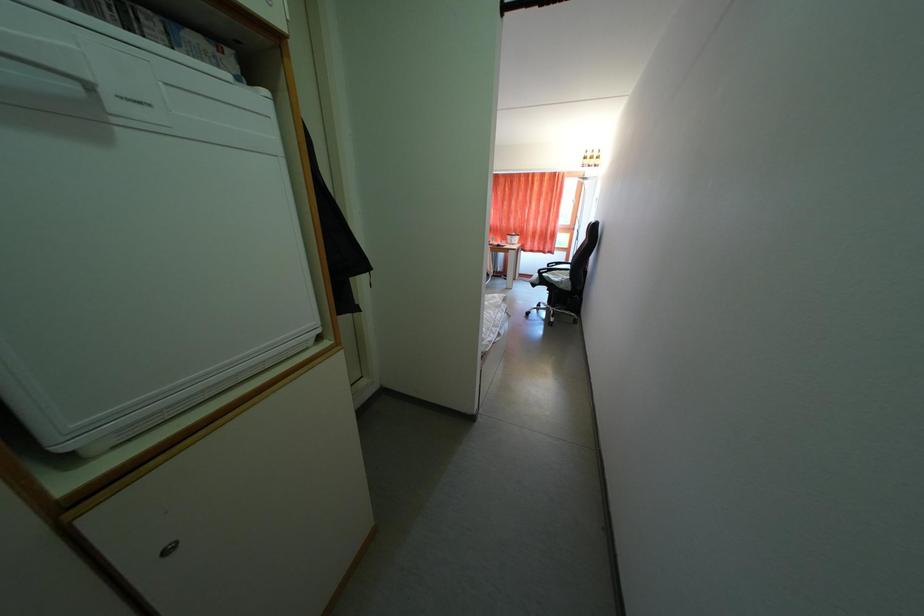
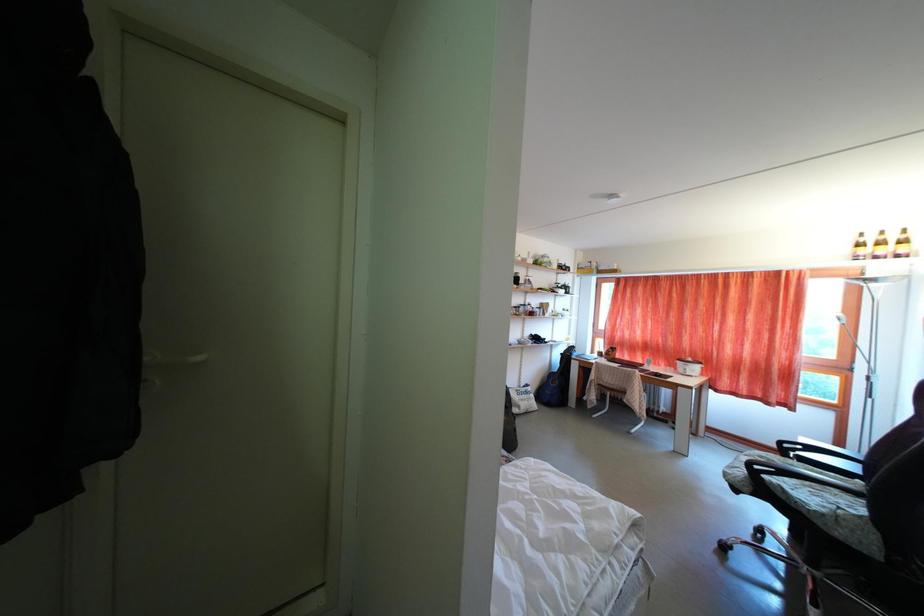
First-person continuous shooting, in which direction is the camera rotating?

The rotation direction of the camera is left-up.